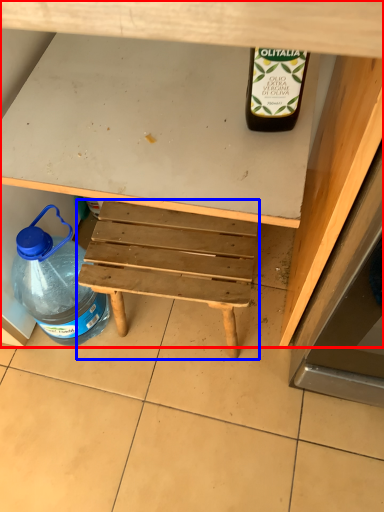
Question: Among these objects, which one is nearest to the camera, desk (highlighted by a red box) or stool (highlighted by a blue box)?

Choices:
 (A) desk
 (B) stool

Answer: (A)